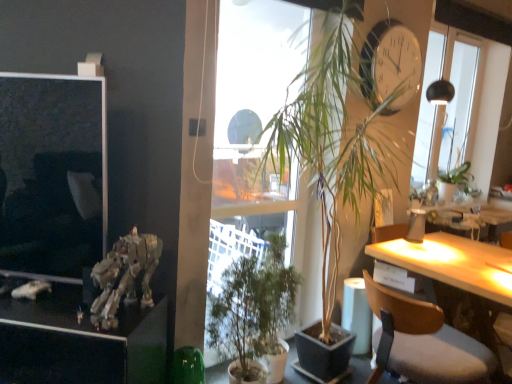
Where is `wooden chair at right`? wooden chair at right is located at coordinates (423, 342).

Identify the location of green matte plant at center, arranged as the second houseplant when ordered from the bottom. (348, 125).

The height and width of the screenshot is (384, 512). Find the location of `white glossy clock at upper right`. white glossy clock at upper right is located at coordinates (390, 64).

This screenshot has height=384, width=512. Describe the element at coordinates (454, 173) in the screenshot. I see `green leafy plant at upper right` at that location.

This screenshot has width=512, height=384. I want to click on metallic gold skeleton at lower left, so click(x=124, y=276).

Which of these two, metallic silver robot at left or green leafy plant at upper right, stands shorter?

With less height is green leafy plant at upper right.

From a real-world perspective, relative to green leafy plant at upper right, is metallic silver robot at left vertically above or below?

metallic silver robot at left is below green leafy plant at upper right.

Does metallic silver robot at left appear on the left side of green leafy plant at upper right?

Yes.

From the picture: How different are the orientations of metallic silver robot at left and green leafy plant at upper right in degrees?

49.6 degrees separate the facing orientations of metallic silver robot at left and green leafy plant at upper right.

From the image's perspective, is metallic gold skeleton at lower left located above or below white glossy clock at upper right?

From the image's perspective, metallic gold skeleton at lower left appears below white glossy clock at upper right.

Is metallic gold skeleton at lower left positioned beyond the bounds of white glossy clock at upper right?

Indeed, metallic gold skeleton at lower left is completely outside white glossy clock at upper right.

Is metallic gold skeleton at lower left aimed at white glossy clock at upper right?

No, metallic gold skeleton at lower left is not facing towards white glossy clock at upper right.

Between metallic gold skeleton at lower left and green matte plant at center, which is the first houseplant in top-to-bottom order, which one appears on the right side from the viewer's perspective?

Positioned to the right is green matte plant at center, which is the first houseplant in top-to-bottom order.

Is metallic gold skeleton at lower left not within green matte plant at center, arranged as the second houseplant when ordered from the bottom?

metallic gold skeleton at lower left is positioned outside green matte plant at center, arranged as the second houseplant when ordered from the bottom.

From the image's perspective, who appears lower, metallic gold skeleton at lower left or green matte plant at center, arranged as the second houseplant when ordered from the bottom?

metallic gold skeleton at lower left, from the image's perspective.

How different are the orientations of metallic gold skeleton at lower left and green matte plant at center, which is the first houseplant in top-to-bottom order, in degrees?

The facing directions of metallic gold skeleton at lower left and green matte plant at center, which is the first houseplant in top-to-bottom order, are 64.3 degrees apart.

Which is behind, point (398, 61) or point (382, 100)?

Positioned behind is point (382, 100).

Is white glossy clock at upper right turned away from green matte plant at center, arranged as the second houseplant when ordered from the bottom?

white glossy clock at upper right is not turned away from green matte plant at center, arranged as the second houseplant when ordered from the bottom.

Are white glossy clock at upper right and green matte plant at center, which is the first houseplant in top-to-bottom order, far apart?

No, white glossy clock at upper right is not far from green matte plant at center, which is the first houseplant in top-to-bottom order.

Is white glossy clock at upper right taller than green matte plant at center, which is the first houseplant in top-to-bottom order?

In fact, white glossy clock at upper right may be shorter than green matte plant at center, which is the first houseplant in top-to-bottom order.

Between green matte plant at center, placed as the second houseplant when sorted from top to bottom, and metallic silver robot at left, which one appears on the left side from the viewer's perspective?

metallic silver robot at left.

Which object is further away from the camera, green matte plant at center, which ranks as the 1th houseplant in bottom-to-top order, or metallic silver robot at left?

green matte plant at center, which ranks as the 1th houseplant in bottom-to-top order, is behind.

Does point (241, 362) appear closer or farther from the camera than point (7, 315)?

Clearly, point (241, 362) is more distant from the camera than point (7, 315).

How far apart are green matte plant at center, placed as the second houseplant when sorted from top to bottom, and metallic silver robot at left?

They are 22.79 inches apart.

Is green matte plant at center, which ranks as the 1th houseplant in bottom-to-top order, looking in the opposite direction of transparent glass window at upper right?

No, transparent glass window at upper right is not at the back of green matte plant at center, which ranks as the 1th houseplant in bottom-to-top order.

You are a GUI agent. You are given a task and a screenshot of the screen. Output one action in this format:
    pyautogui.click(x=<x>, y=<y>)
    Task: Click on the window to the right of green matte plant at center, which ranks as the 1th houseplant in bottom-to-top order
    The width and height of the screenshot is (512, 384).
    Given the screenshot: What is the action you would take?
    pyautogui.click(x=468, y=93)

From the image's perspective, which is above, green matte plant at center, which ranks as the 1th houseplant in bottom-to-top order, or transparent glass window at upper right?

transparent glass window at upper right appears higher in the image.

Choose the correct answer: Is green matte plant at center, which ranks as the 1th houseplant in bottom-to-top order, inside transparent glass window at upper right or outside it?

green matte plant at center, which ranks as the 1th houseplant in bottom-to-top order, is outside transparent glass window at upper right.

Is wooden chair at right to the left of green matte plant at center, arranged as the second houseplant when ordered from the bottom, from the viewer's perspective?

No.

Measure the distance between wooden chair at right and green matte plant at center, which is the first houseplant in top-to-bottom order.

wooden chair at right and green matte plant at center, which is the first houseplant in top-to-bottom order, are 29.35 inches apart from each other.

Is wooden chair at right oriented towards green matte plant at center, which is the first houseplant in top-to-bottom order?

No, wooden chair at right is not aimed at green matte plant at center, which is the first houseplant in top-to-bottom order.

Can you confirm if wooden chair at right is taller than green matte plant at center, arranged as the second houseplant when ordered from the bottom?

No, wooden chair at right is not taller than green matte plant at center, arranged as the second houseplant when ordered from the bottom.

At what (x,y) coordinates should I click in order to perform the action: click on cabinetry that appears below the green leafy plant at upper right (from a real-world perspective). Please return your answer as a coordinate pair (x, y). The image size is (512, 384). Looking at the image, I should click on (80, 341).

Image resolution: width=512 pixels, height=384 pixels. I want to click on skeleton that is below the white glossy clock at upper right (from the image's perspective), so click(x=124, y=276).

When comparing their distances from green matte plant at center, which ranks as the 1th houseplant in bottom-to-top order, does green leafy plant at upper right or green matte plant at center, arranged as the second houseplant when ordered from the bottom, seem further?

green leafy plant at upper right.

From the image, which object appears to be farther from metallic gold skeleton at lower left, wooden chair at right or green leafy plant at upper right?

green leafy plant at upper right.

Looking at the image, which one is located further to wooden chair at right, metallic gold skeleton at lower left or green matte plant at center, arranged as the second houseplant when ordered from the bottom?

metallic gold skeleton at lower left lies further to wooden chair at right than the other object.

Estimate the real-world distances between objects in this image. Which object is further from green leafy plant at upper right, green matte plant at center, which is the first houseplant in top-to-bottom order, or transparent glass window at upper right?

The object further to green leafy plant at upper right is green matte plant at center, which is the first houseplant in top-to-bottom order.

Considering their positions, is metallic gold skeleton at lower left positioned closer to wooden chair at right than green leafy plant at upper right?

Based on the image, metallic gold skeleton at lower left appears to be nearer to wooden chair at right.

Estimate the real-world distances between objects in this image. Which object is further from green matte plant at center, arranged as the second houseplant when ordered from the bottom, metallic silver robot at left or green matte plant at center, placed as the second houseplant when sorted from top to bottom?

metallic silver robot at left is positioned further to the anchor green matte plant at center, arranged as the second houseplant when ordered from the bottom.

Considering their positions, is metallic gold skeleton at lower left positioned closer to green leafy plant at upper right than green matte plant at center, arranged as the second houseplant when ordered from the bottom?

The object closer to green leafy plant at upper right is green matte plant at center, arranged as the second houseplant when ordered from the bottom.

Looking at the image, which one is located further to green matte plant at center, placed as the second houseplant when sorted from top to bottom, transparent glass window at upper right or wooden chair at right?

Based on the image, transparent glass window at upper right appears to be further to green matte plant at center, placed as the second houseplant when sorted from top to bottom.

Locate an element on the screen. clock between green matte plant at center, which is the first houseplant in top-to-bottom order, and transparent glass window at upper right in the front-back direction is located at coordinates (390, 64).

At what (x,y) coordinates should I click in order to perform the action: click on houseplant between green matte plant at center, arranged as the second houseplant when ordered from the bottom, and transparent glass window at upper right in the front-back direction. Please return your answer as a coordinate pair (x, y). Looking at the image, I should click on pyautogui.click(x=254, y=309).

Where is `houseplant that lies between green matte plant at center, which is the first houseplant in top-to-bottom order, and wooden chair at right from top to bottom`? The height and width of the screenshot is (384, 512). houseplant that lies between green matte plant at center, which is the first houseplant in top-to-bottom order, and wooden chair at right from top to bottom is located at coordinates (254, 309).

In order to click on chair situated between metallic silver robot at left and white glossy clock at upper right from left to right in this screenshot , I will do `click(423, 342)`.